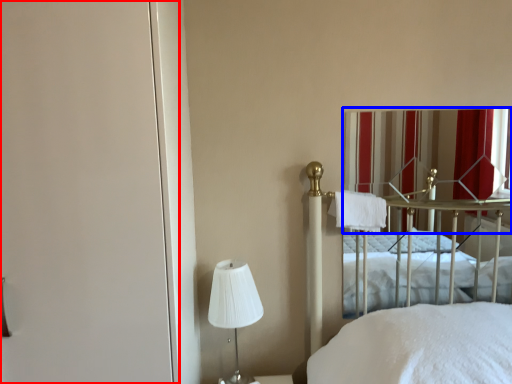
Question: Which of the following is the closest to the observer, screen door (highlighted by a red box) or curtain (highlighted by a blue box)?

Choices:
 (A) screen door
 (B) curtain

Answer: (A)